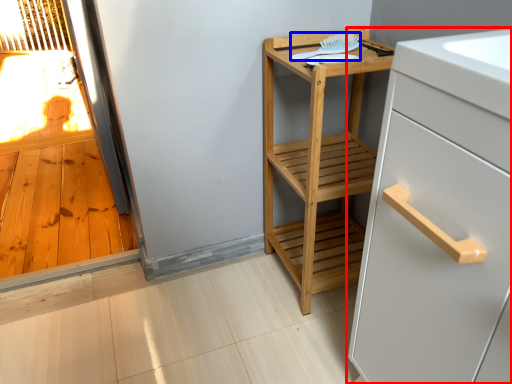
Question: Among these objects, which one is nearest to the camera, cabinetry (highlighted by a red box) or brush (highlighted by a blue box)?

Choices:
 (A) cabinetry
 (B) brush

Answer: (A)